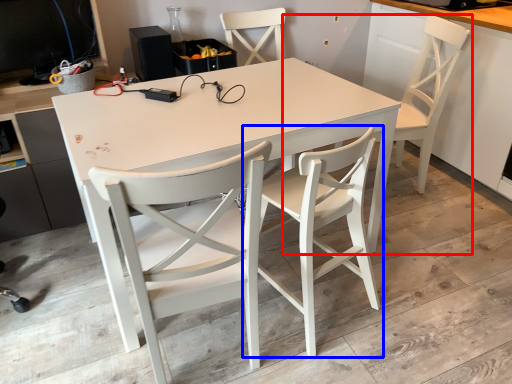
Question: Among these objects, which one is farthest to the camera, chair (highlighted by a red box) or chair (highlighted by a blue box)?

Choices:
 (A) chair
 (B) chair

Answer: (A)